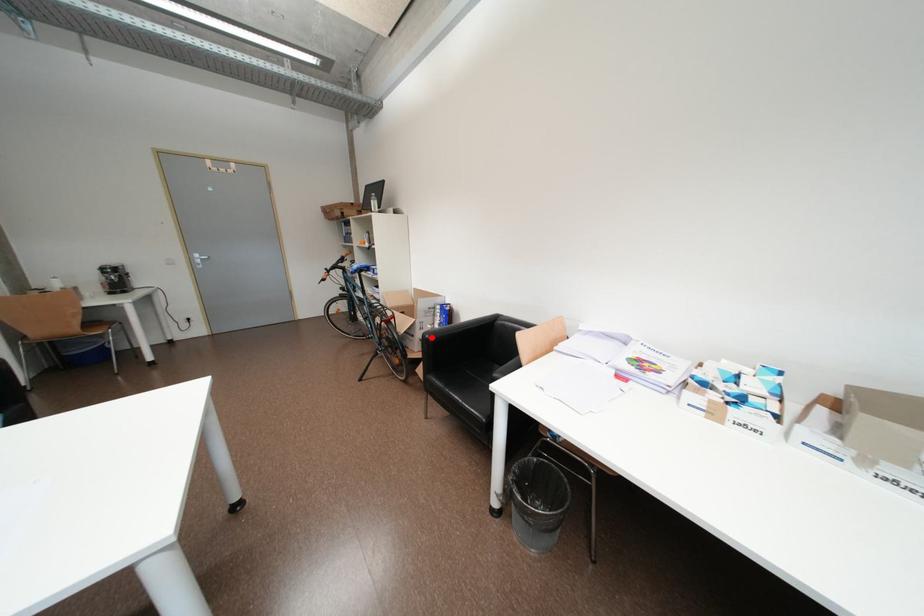
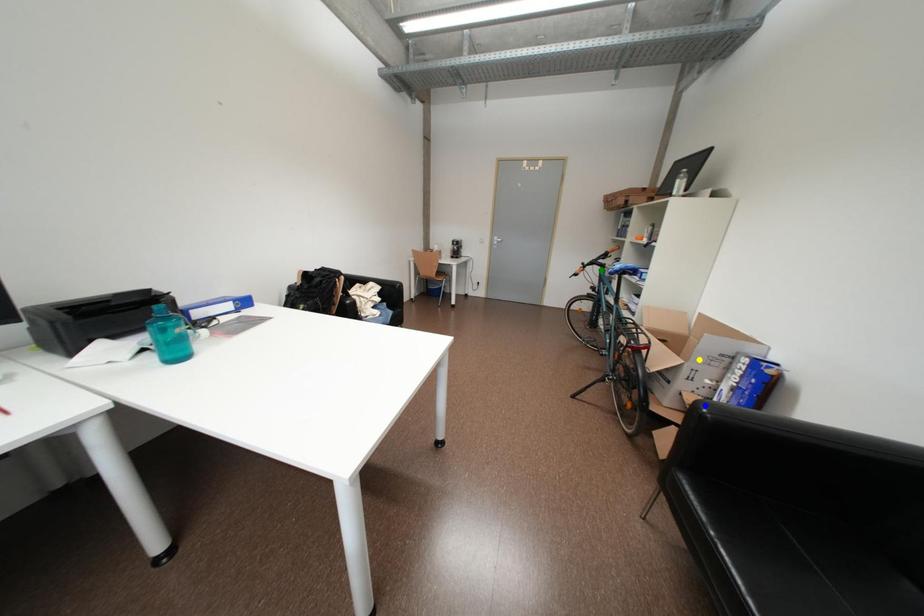
Question: I am providing you with two images of the same scene from different viewpoints. A red point is marked on the first image. You are given multiple points on the second image. Can you choose the point in image 2 that corresponds to the point in image 1?

Choices:
 (A) green point
 (B) yellow point
 (C) blue point

Answer: (C)